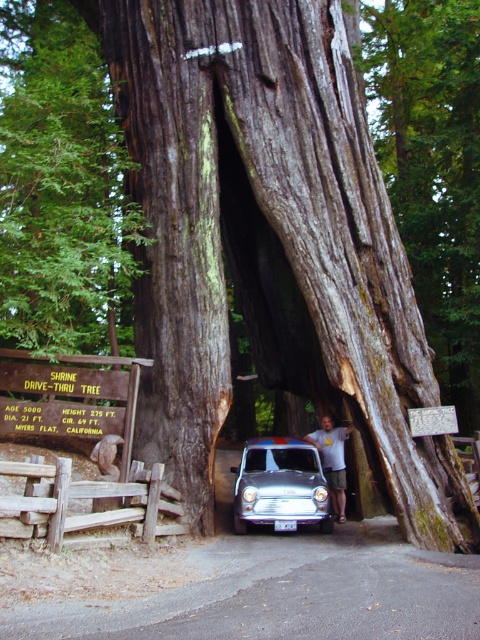
Question: Does shiny silver car at center appear over white t-shirt at center?

Choices:
 (A) no
 (B) yes

Answer: (A)

Question: Can you confirm if shiny silver car at center is positioned to the left of white t-shirt at center?

Choices:
 (A) no
 (B) yes

Answer: (B)

Question: Is shiny silver car at center positioned in front of white t-shirt at center?

Choices:
 (A) yes
 (B) no

Answer: (A)

Question: Among these objects, which one is nearest to the camera?

Choices:
 (A) white t-shirt at center
 (B) shiny silver car at center

Answer: (B)

Question: Which object is closer to the camera taking this photo?

Choices:
 (A) shiny silver car at center
 (B) white t-shirt at center

Answer: (A)